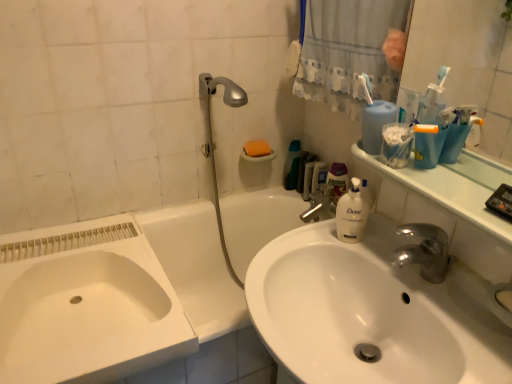
Question: Considering the relative sizes of white ceramic bathtub at lower left and white glossy sink at center, which appears as the first sink when viewed from the right, in the image provided, is white ceramic bathtub at lower left thinner than white glossy sink at center, which appears as the first sink when viewed from the right,?

Choices:
 (A) yes
 (B) no

Answer: (B)

Question: Considering the relative sizes of white ceramic bathtub at lower left and white glossy sink at center, which appears as the first sink when viewed from the right, in the image provided, is white ceramic bathtub at lower left bigger than white glossy sink at center, which appears as the first sink when viewed from the right,?

Choices:
 (A) yes
 (B) no

Answer: (A)

Question: From a real-world perspective, is white ceramic bathtub at lower left on white glossy sink at center, which appears as the first sink when viewed from the right?

Choices:
 (A) yes
 (B) no

Answer: (B)

Question: From the image's perspective, is white ceramic bathtub at lower left located beneath white glossy sink at center, placed as the 2th sink when sorted from left to right?

Choices:
 (A) no
 (B) yes

Answer: (B)

Question: Is white ceramic bathtub at lower left closer to camera compared to white glossy sink at center, placed as the 2th sink when sorted from left to right?

Choices:
 (A) yes
 (B) no

Answer: (B)

Question: From the image's perspective, is white ceramic bathtub at lower left on white glossy sink at center, which appears as the first sink when viewed from the right?

Choices:
 (A) yes
 (B) no

Answer: (B)

Question: Considering the relative sizes of clear plastic mouthwash at center and white ceramic bathtub at lower left in the image provided, is clear plastic mouthwash at center bigger than white ceramic bathtub at lower left?

Choices:
 (A) no
 (B) yes

Answer: (A)

Question: Is clear plastic mouthwash at center at the right side of white ceramic bathtub at lower left?

Choices:
 (A) yes
 (B) no

Answer: (A)

Question: Considering the relative sizes of clear plastic mouthwash at center and white ceramic bathtub at lower left in the image provided, is clear plastic mouthwash at center smaller than white ceramic bathtub at lower left?

Choices:
 (A) yes
 (B) no

Answer: (A)

Question: Can you confirm if clear plastic mouthwash at center is positioned to the left of white ceramic bathtub at lower left?

Choices:
 (A) yes
 (B) no

Answer: (B)

Question: Is clear plastic mouthwash at center completely or partially outside of white ceramic bathtub at lower left?

Choices:
 (A) yes
 (B) no

Answer: (A)

Question: Considering the relative sizes of clear plastic mouthwash at center and white ceramic bathtub at lower left in the image provided, is clear plastic mouthwash at center taller than white ceramic bathtub at lower left?

Choices:
 (A) yes
 (B) no

Answer: (B)

Question: Is white ceramic bathtub at lower left in front of orange sponge at upper center?

Choices:
 (A) yes
 (B) no

Answer: (A)